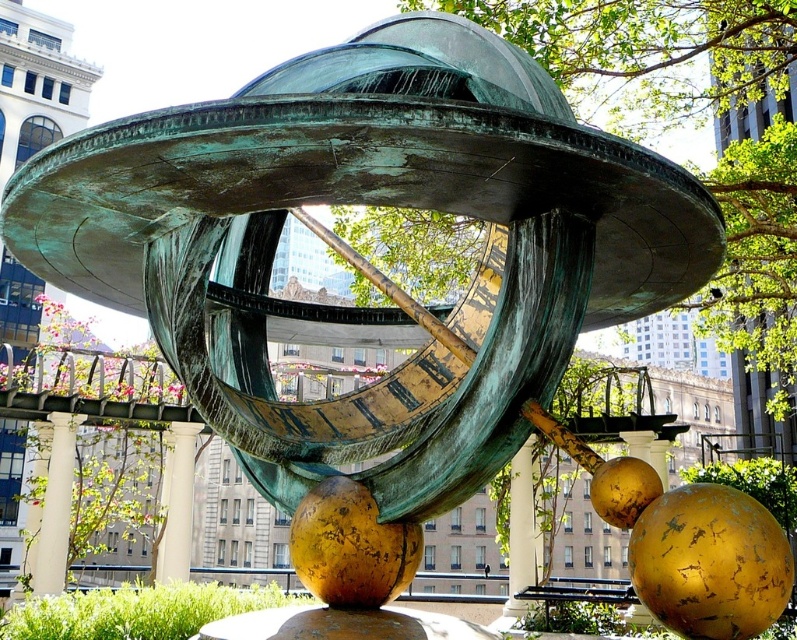
Question: Estimate the real-world distances between objects in this image. Which object is closer to the green patina pillar at center?

Choices:
 (A) white marble pillar at center
 (B) white marble pillar at lower left

Answer: (A)

Question: Which is nearer to the white marble pillar at lower left?

Choices:
 (A) green patina pillar at center
 (B) white marble pillar at center

Answer: (B)

Question: Does white marble pillar at lower left appear on the left side of green patina pillar at center?

Choices:
 (A) yes
 (B) no

Answer: (A)

Question: Does white marble pillar at lower left come behind green patina pillar at center?

Choices:
 (A) no
 (B) yes

Answer: (A)

Question: Which object appears closest to the camera in this image?

Choices:
 (A) white marble pillar at center
 (B) white marble pillar at lower left

Answer: (B)

Question: Can you confirm if white marble pillar at lower left is positioned below green patina pillar at center?

Choices:
 (A) yes
 (B) no

Answer: (B)